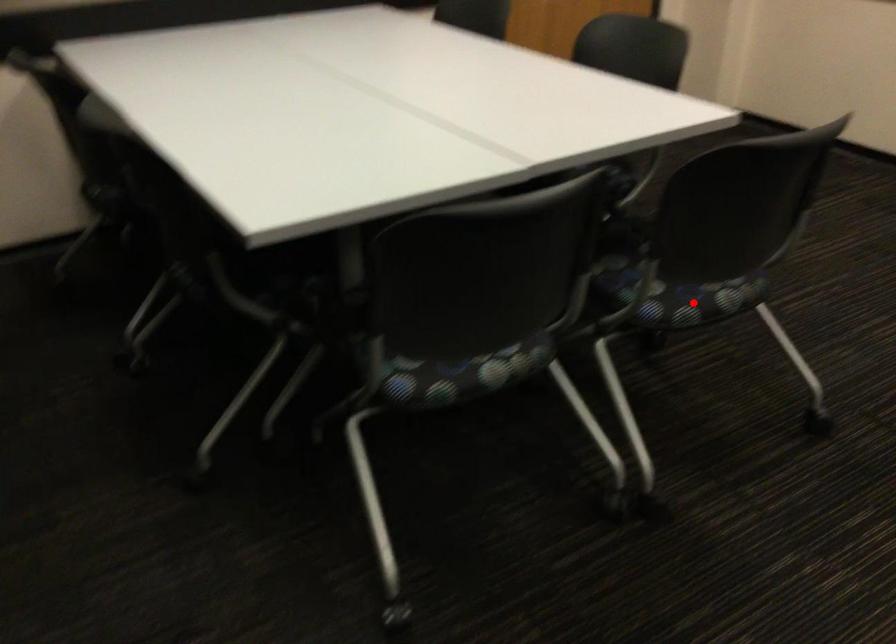
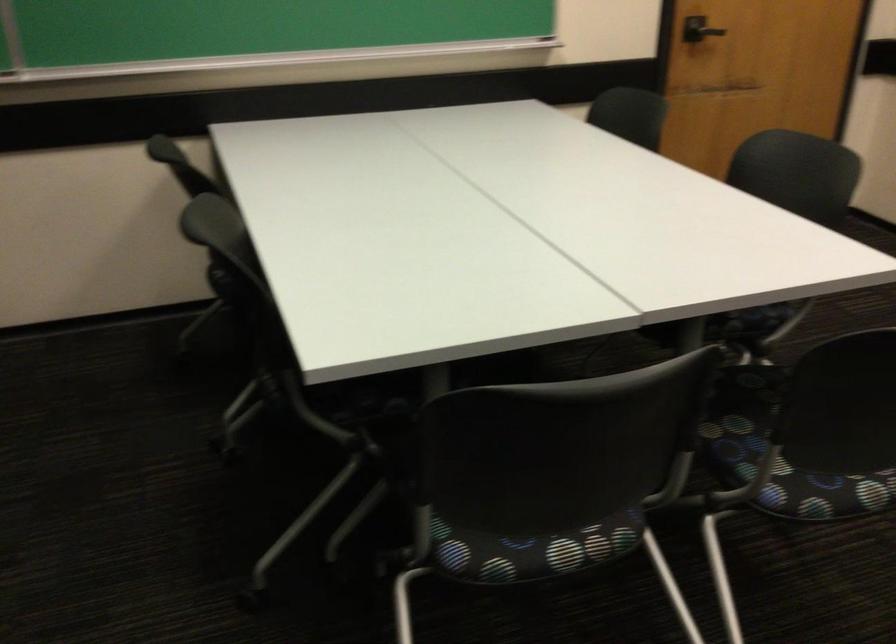
Find the pixel in the second image that matches the highlighted location in the first image.

(823, 493)